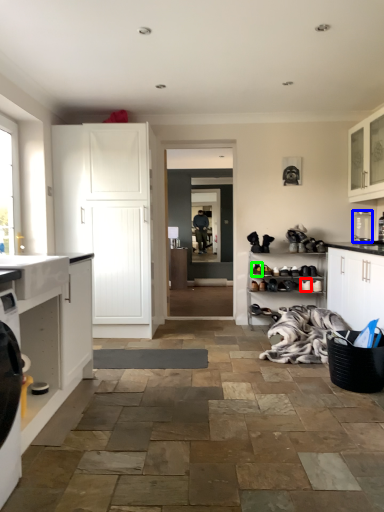
Question: Which is farther away from shoe (highlighted by a red box)? appliance (highlighted by a blue box) or shoe (highlighted by a green box)?

Choices:
 (A) appliance
 (B) shoe

Answer: (A)